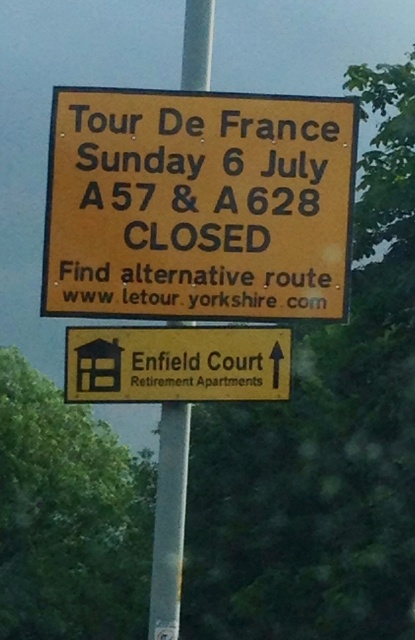
Can you confirm if yellow matte sign at upper center is positioned to the left of silver metallic pole at center?

Incorrect, yellow matte sign at upper center is not on the left side of silver metallic pole at center.

Can you confirm if yellow matte sign at upper center is thinner than silver metallic pole at center?

No, yellow matte sign at upper center is not thinner than silver metallic pole at center.

Which is behind, point (146, 227) or point (180, 460)?

Point (180, 460)

I want to click on yellow matte sign at upper center, so click(197, 204).